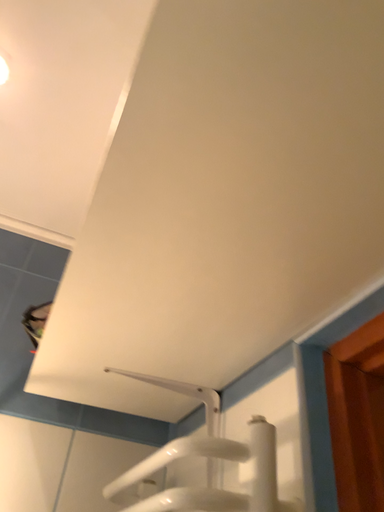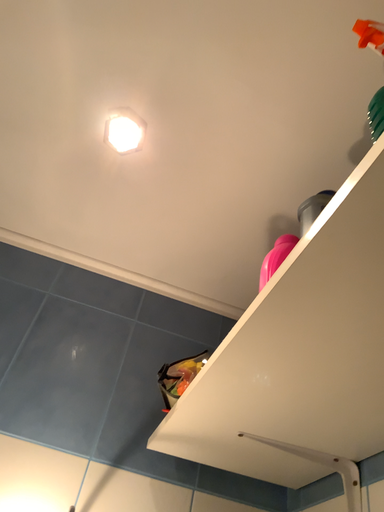
Question: How did the camera likely rotate when shooting the video?

Choices:
 (A) rotated right
 (B) rotated left

Answer: (B)